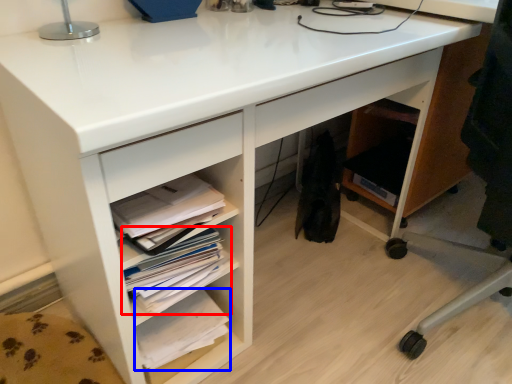
Question: Among these objects, which one is nearest to the camera, book (highlighted by a red box) or book (highlighted by a blue box)?

Choices:
 (A) book
 (B) book

Answer: (A)